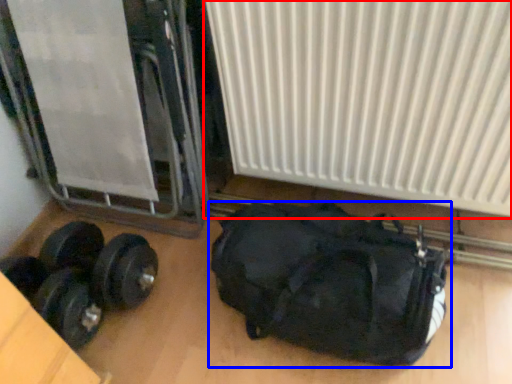
Question: Which object is further to the camera taking this photo, radiator (highlighted by a red box) or luggage and bags (highlighted by a blue box)?

Choices:
 (A) radiator
 (B) luggage and bags

Answer: (B)